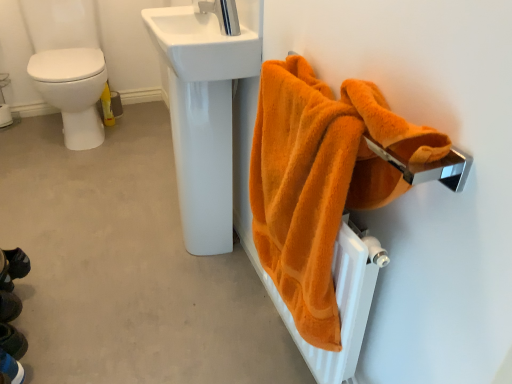
Question: Considering their positions, is white glossy sink at upper center located in front of or behind orange fluffy towel at right?

Choices:
 (A) behind
 (B) front

Answer: (A)

Question: From a real-world perspective, is white glossy sink at upper center above or below orange fluffy towel at right?

Choices:
 (A) below
 (B) above

Answer: (B)

Question: Considering the real-world distances, which object is farthest from the white glossy sink at upper center?

Choices:
 (A) dark blue fabric shoes at lower left
 (B) orange fluffy towel at right
 (C) silver metallic tap at upper center
 (D) white leather shoe at lower left

Answer: (D)

Question: Which object is positioned farthest from the silver metallic tap at upper center?

Choices:
 (A) dark blue fabric shoes at lower left
 (B) white leather shoe at lower left
 (C) white glossy sink at upper center
 (D) orange fluffy towel at right

Answer: (A)